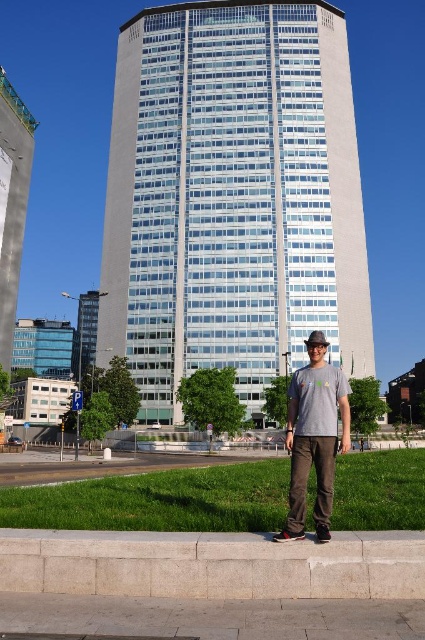
Does glassy white building at center have a greater height compared to white glass building at left?

Correct, glassy white building at center is much taller as white glass building at left.

Between point (224, 60) and point (5, 264), which one is positioned behind?

Point (224, 60)

Locate an element on the screen. The width and height of the screenshot is (425, 640). glassy white building at center is located at coordinates (232, 198).

Who is higher up, glassy white building at center or gray concrete curb at lower center?

glassy white building at center

Is point (138, 348) less distant than point (414, 582)?

No, (138, 348) is further to viewer.

Measure the distance between point (147,35) and camera.

A distance of 291.41 feet exists between point (147,35) and camera.

Image resolution: width=425 pixels, height=640 pixels. Identify the location of glassy white building at center. (232, 198).

Is gray concrete curb at lower center closer to the viewer compared to white glass building at left?

That is True.

Can you confirm if gray concrete curb at lower center is positioned to the right of white glass building at left?

Indeed, gray concrete curb at lower center is positioned on the right side of white glass building at left.

Between point (336, 552) and point (2, 211), which one is positioned in front?

Point (336, 552)

Find the location of a particular element. The height and width of the screenshot is (640, 425). gray concrete curb at lower center is located at coordinates (212, 564).